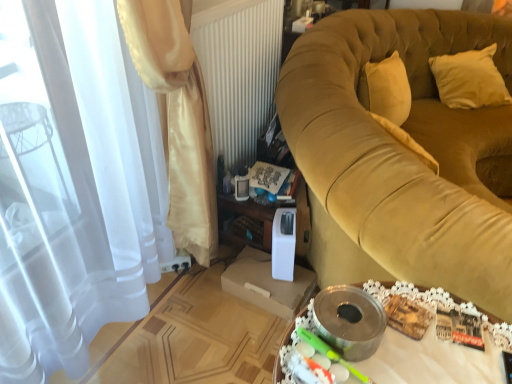
Question: Considering their positions, is satin curtain at left, which ranks as the 1th curtain in front-to-back order, located in front of or behind satin curtain at left, which appears as the 1th curtain when viewed from the back?

Choices:
 (A) front
 (B) behind

Answer: (A)

Question: Is satin curtain at left, the second curtain when ordered from back to front, inside or outside of satin curtain at left, which appears as the 1th curtain when viewed from the back?

Choices:
 (A) inside
 (B) outside

Answer: (B)

Question: Estimate the real-world distances between objects in this image. Which object is farther from the beige fabric pillow at upper right?

Choices:
 (A) velvet gold couch at right
 (B) satin curtain at left, the second curtain positioned from the front
 (C) satin curtain at left, which ranks as the 1th curtain in front-to-back order
 (D) metallic silver tray at lower center

Answer: (C)

Question: Estimate the real-world distances between objects in this image. Which object is farther from the beige fabric pillow at upper right?

Choices:
 (A) satin curtain at left, the second curtain when ordered from back to front
 (B) metallic silver tray at lower center
 (C) velvet gold couch at right
 (D) satin curtain at left, which appears as the 1th curtain when viewed from the back

Answer: (A)